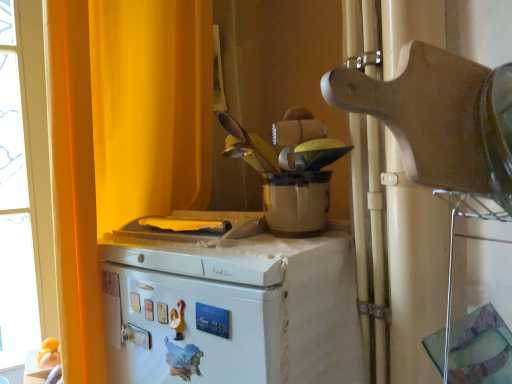
Locate an element on the screen. free point below matte white pot at center, the first appliance positioned from the back (from a real-world perspective) is located at coordinates (263, 235).